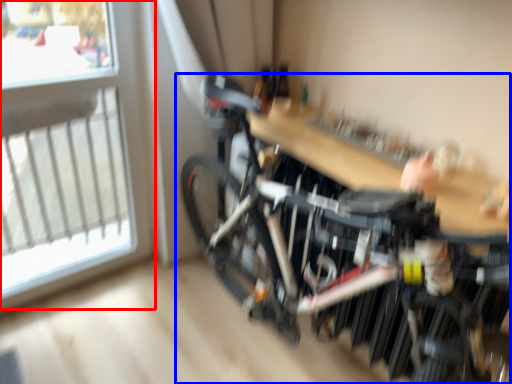
Question: Which object appears closest to the camera in this image, window (highlighted by a red box) or bicycle (highlighted by a blue box)?

Choices:
 (A) window
 (B) bicycle

Answer: (B)